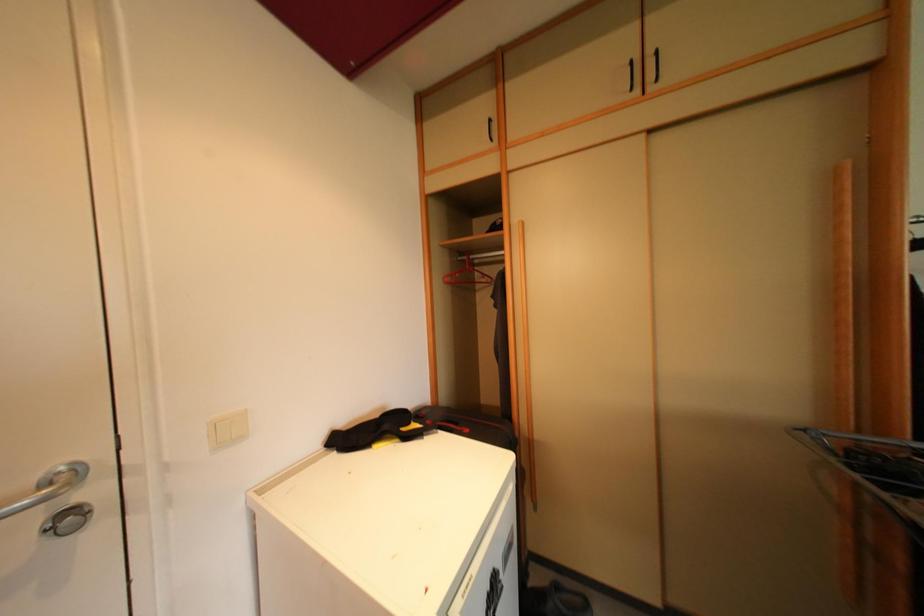
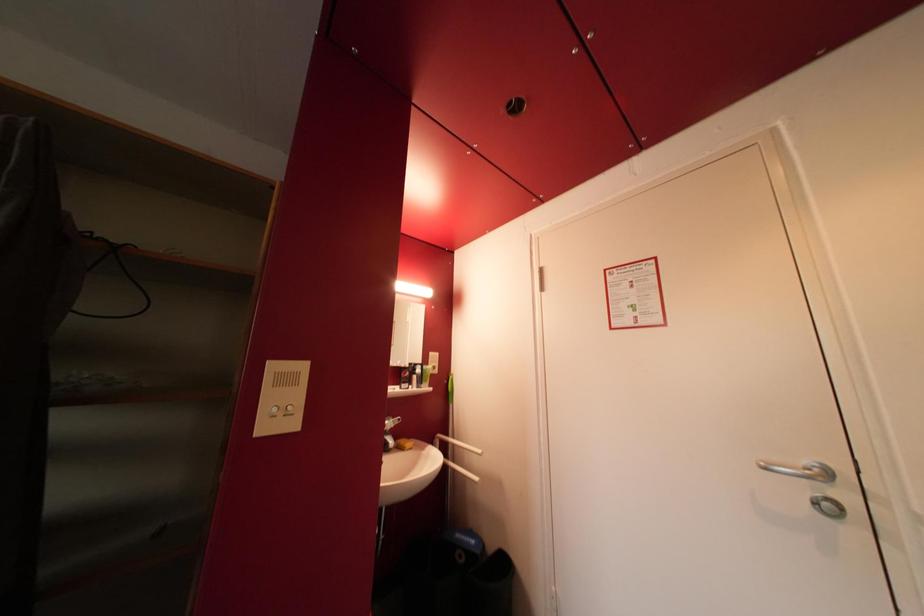
Question: How did the camera likely rotate?

Choices:
 (A) Left
 (B) Right
 (C) Up
 (D) Down

Answer: (A)